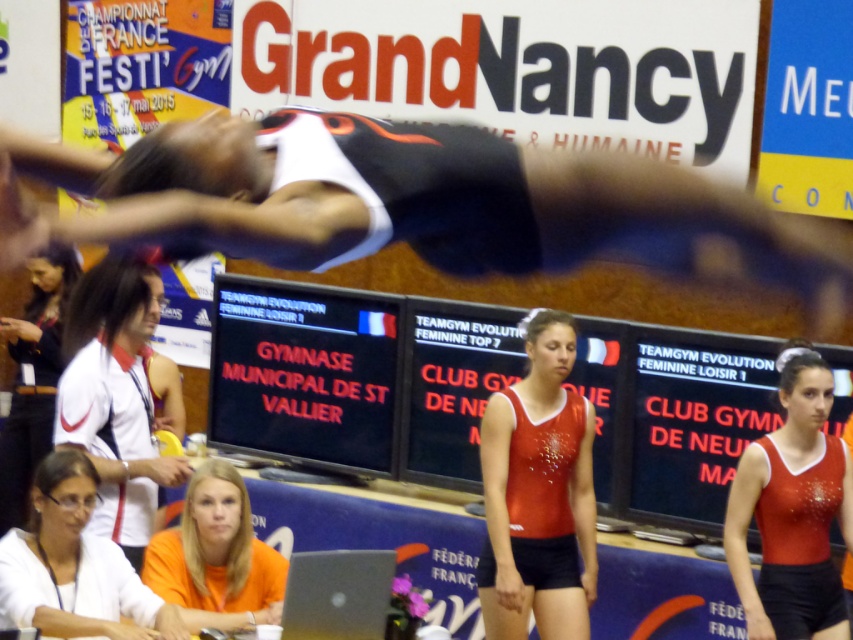
You are a photographer standing in the gym. You need to capture a photo where both the shiny red leotard at center and the orange fabric shirt at lower center are visible. Which object should you focus on first to ensure both are in frame?

You should focus on the shiny red leotard at center first because it has a greater height compared to the orange fabric shirt at lower center, so adjusting the frame to include its taller size will naturally include the shorter orange fabric shirt at lower center as well.

You are a photographer at the event and want to capture both the shiny red leotard at center and the white fabric shirt at left in a single frame. Which object should you focus on first to ensure both are in the frame?

The shiny red leotard at center occupies less space than the white fabric shirt at left, so you should focus on the white fabric shirt at left first to ensure both are in the frame.